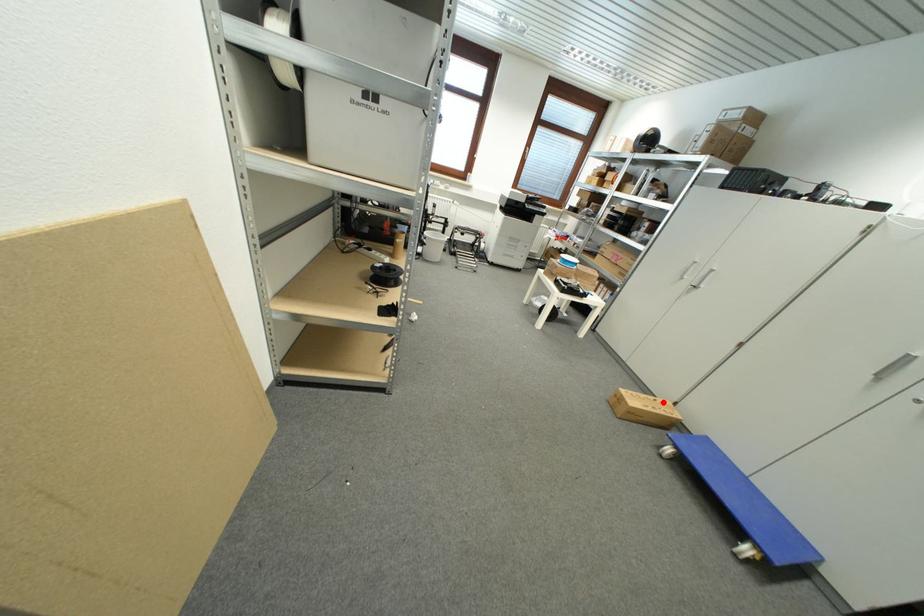
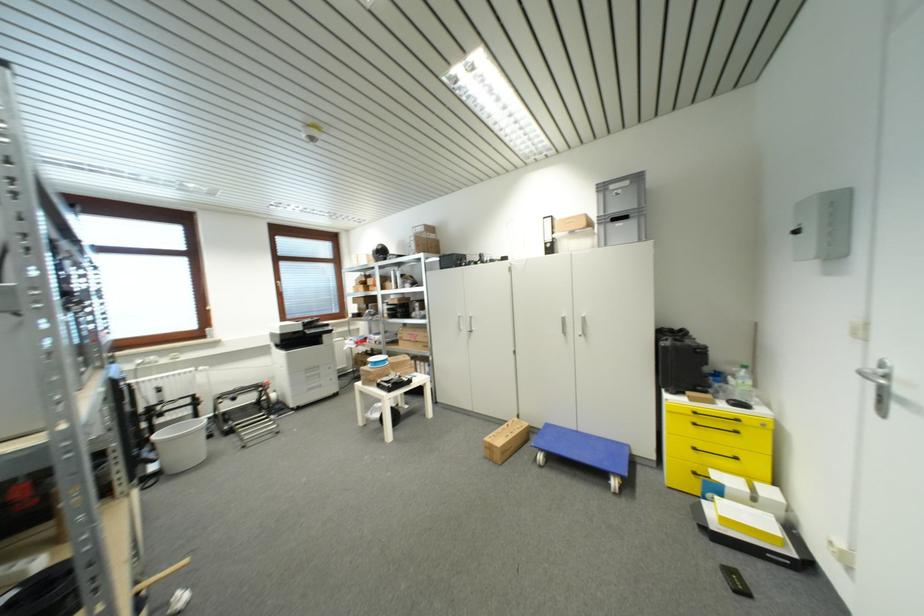
The point at the highlighted location is marked in the first image. Where is the corresponding point in the second image?

(514, 426)